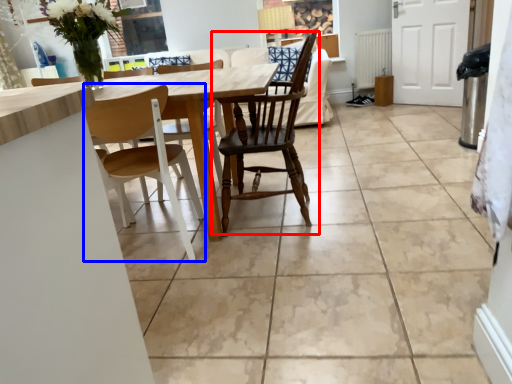
Question: Among these objects, which one is farthest to the camera, chair (highlighted by a red box) or chair (highlighted by a blue box)?

Choices:
 (A) chair
 (B) chair

Answer: (A)